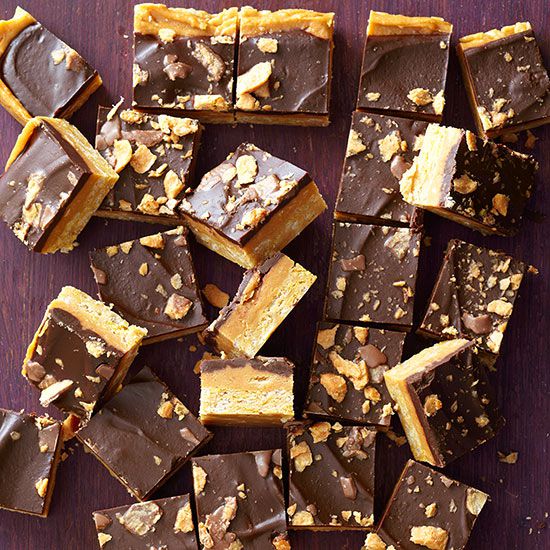
Find the location of a particular element. empty space on table is located at coordinates (31, 297).